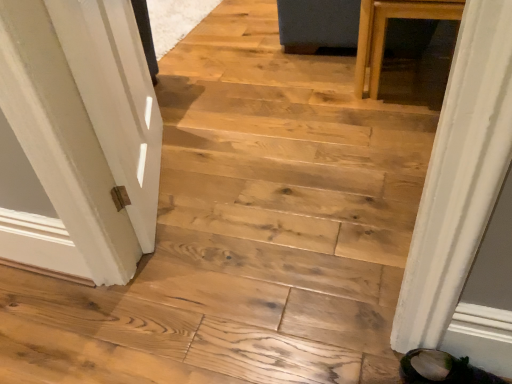
Question: Can you confirm if green suede shoe at lower right is shorter than white painted wood door at left?

Choices:
 (A) no
 (B) yes

Answer: (B)

Question: Is green suede shoe at lower right positioned before white painted wood door at left?

Choices:
 (A) no
 (B) yes

Answer: (B)

Question: Would you say green suede shoe at lower right is outside white painted wood door at left?

Choices:
 (A) no
 (B) yes

Answer: (B)

Question: From the image's perspective, is green suede shoe at lower right located beneath white painted wood door at left?

Choices:
 (A) yes
 (B) no

Answer: (A)

Question: Can you see green suede shoe at lower right touching white painted wood door at left?

Choices:
 (A) no
 (B) yes

Answer: (A)

Question: Considering the relative sizes of green suede shoe at lower right and white painted wood door at left in the image provided, is green suede shoe at lower right taller than white painted wood door at left?

Choices:
 (A) yes
 (B) no

Answer: (B)

Question: Considering the relative positions of white painted wood door at left and green suede shoe at lower right in the image provided, is white painted wood door at left to the right of green suede shoe at lower right from the viewer's perspective?

Choices:
 (A) yes
 (B) no

Answer: (B)

Question: From a real-world perspective, is white painted wood door at left below green suede shoe at lower right?

Choices:
 (A) yes
 (B) no

Answer: (B)

Question: Can you confirm if white painted wood door at left is thinner than green suede shoe at lower right?

Choices:
 (A) no
 (B) yes

Answer: (B)

Question: Does white painted wood door at left touch green suede shoe at lower right?

Choices:
 (A) no
 (B) yes

Answer: (A)

Question: Can you confirm if white painted wood door at left is taller than green suede shoe at lower right?

Choices:
 (A) no
 (B) yes

Answer: (B)

Question: From the image's perspective, is white painted wood door at left on top of green suede shoe at lower right?

Choices:
 (A) yes
 (B) no

Answer: (A)

Question: Considering their positions, is green suede shoe at lower right located in front of or behind white painted wood door at left?

Choices:
 (A) front
 (B) behind

Answer: (A)